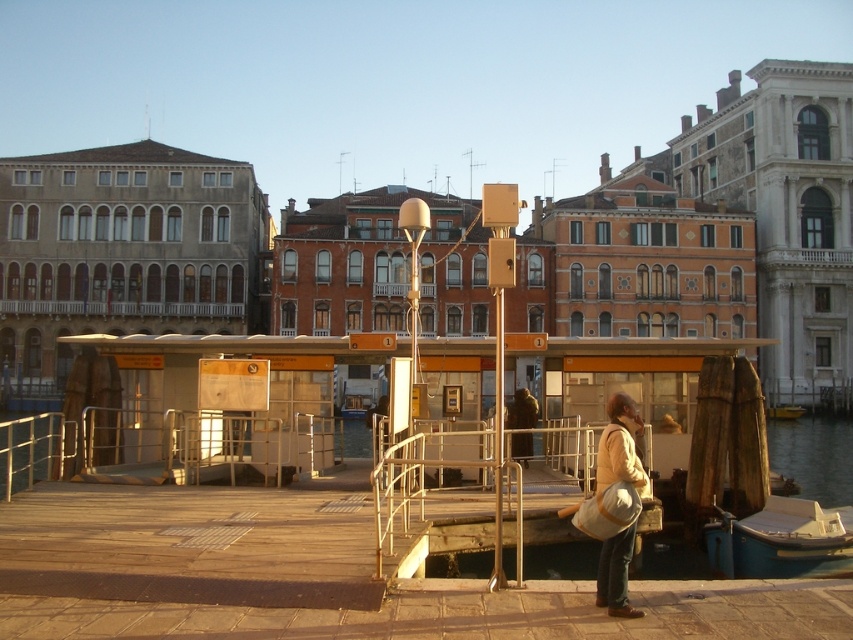
Question: Which point is farther from the camera taking this photo?

Choices:
 (A) (802, 512)
 (B) (636, 472)
 (C) (782, 419)

Answer: (C)

Question: Is blue plastic boat at lower right to the left of light brown fabric bag at lower right from the viewer's perspective?

Choices:
 (A) no
 (B) yes

Answer: (A)

Question: Does blue plastic boat at lower right have a larger size compared to light brown fabric bag at lower right?

Choices:
 (A) yes
 (B) no

Answer: (A)

Question: Which point is closer to the camera taking this photo?

Choices:
 (A) (772, 413)
 (B) (607, 433)

Answer: (B)

Question: Is light brown fabric bag at lower right positioned before yellow matte boat at lower right?

Choices:
 (A) no
 (B) yes

Answer: (B)

Question: Among these points, which one is nearest to the camera?

Choices:
 (A) (799, 406)
 (B) (833, 564)
 (C) (614, 589)

Answer: (C)